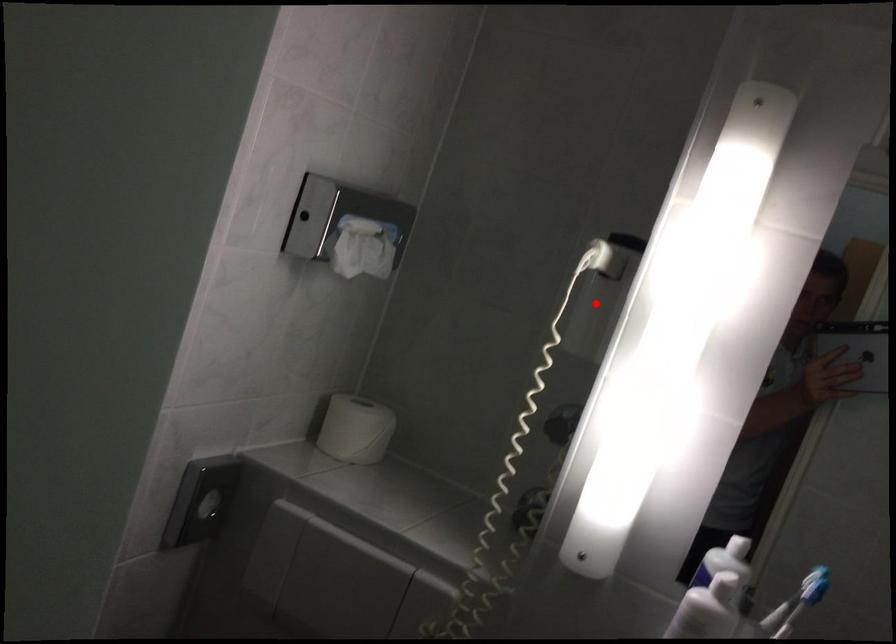
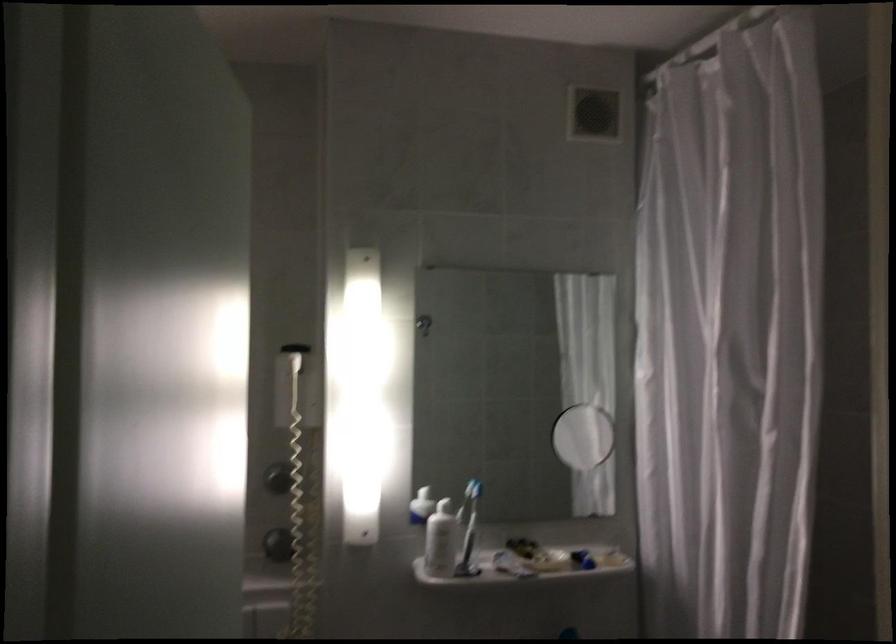
Question: I am providing you with two images of the same scene from different viewpoints. A red point is shown in image1. For the corresponding object point in image2, is it positioned nearer or farther from the camera?

Choices:
 (A) Nearer
 (B) Farther

Answer: (B)